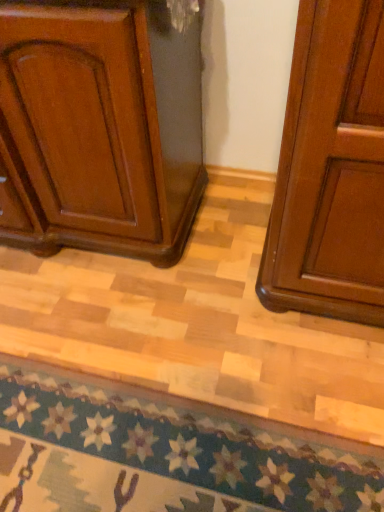
The width and height of the screenshot is (384, 512). What do you see at coordinates (99, 127) in the screenshot?
I see `glossy wood cupboard at left` at bounding box center [99, 127].

Find the location of a particular element. glossy wood cupboard at left is located at coordinates (99, 127).

Locate an element on the screen. This screenshot has height=512, width=384. glossy wood cupboard at left is located at coordinates (99, 127).